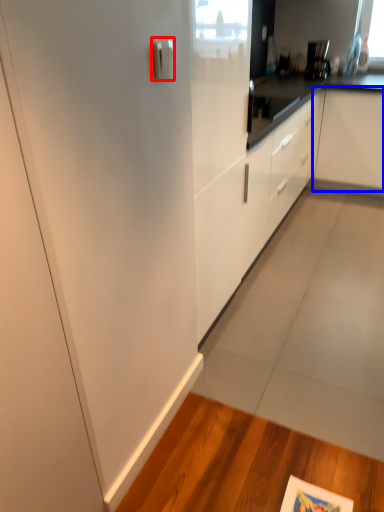
Question: Which object appears farthest to the camera in this image, door handle (highlighted by a red box) or cabinetry (highlighted by a blue box)?

Choices:
 (A) door handle
 (B) cabinetry

Answer: (B)